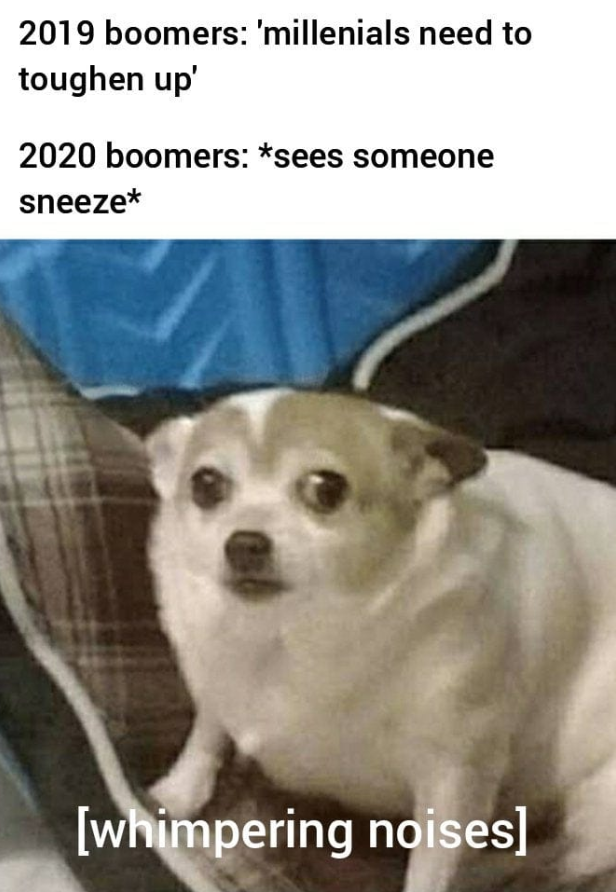
Find the location of `dog bed`. dog bed is located at coordinates (92, 593).